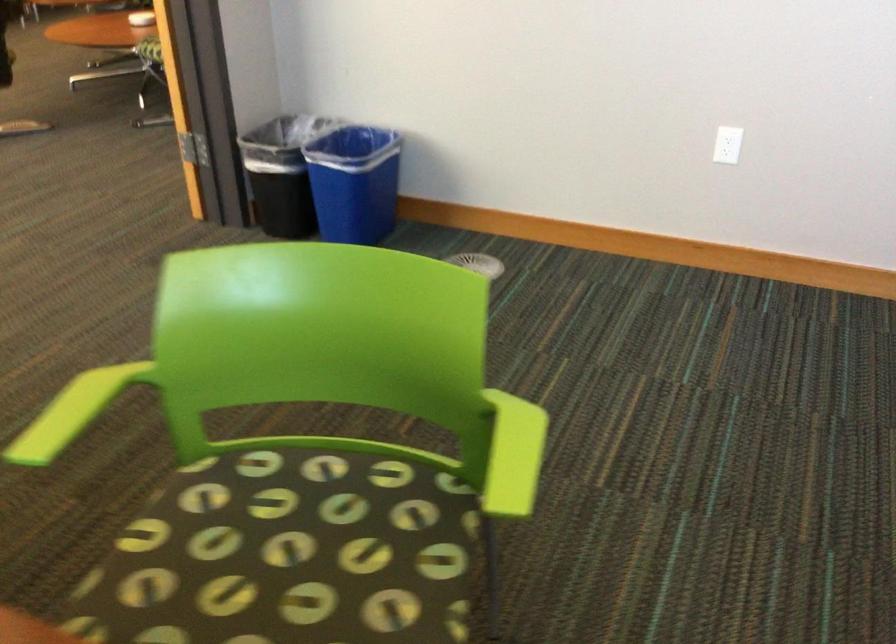
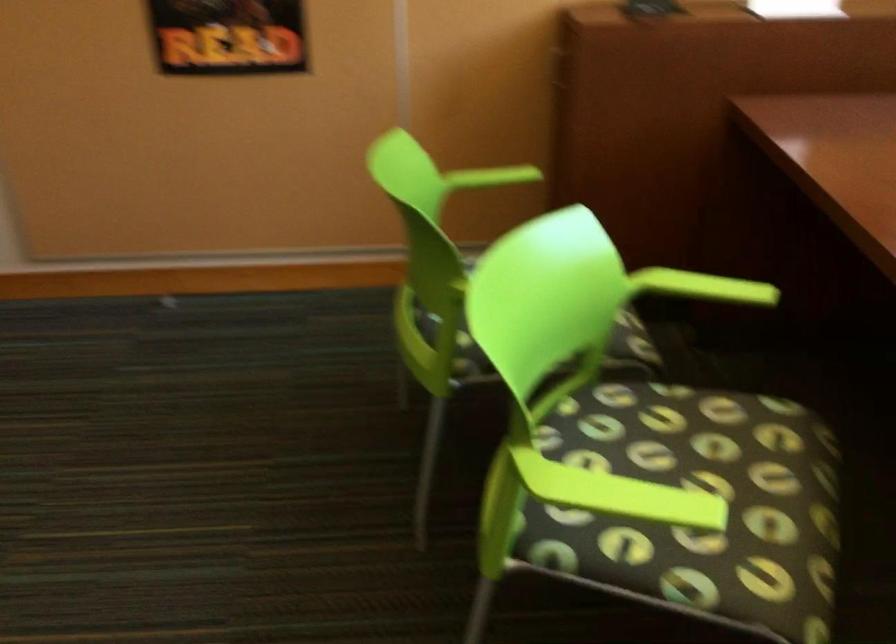
First-person continuous shooting, in which direction is the camera rotating?

The camera rotated toward right-down.